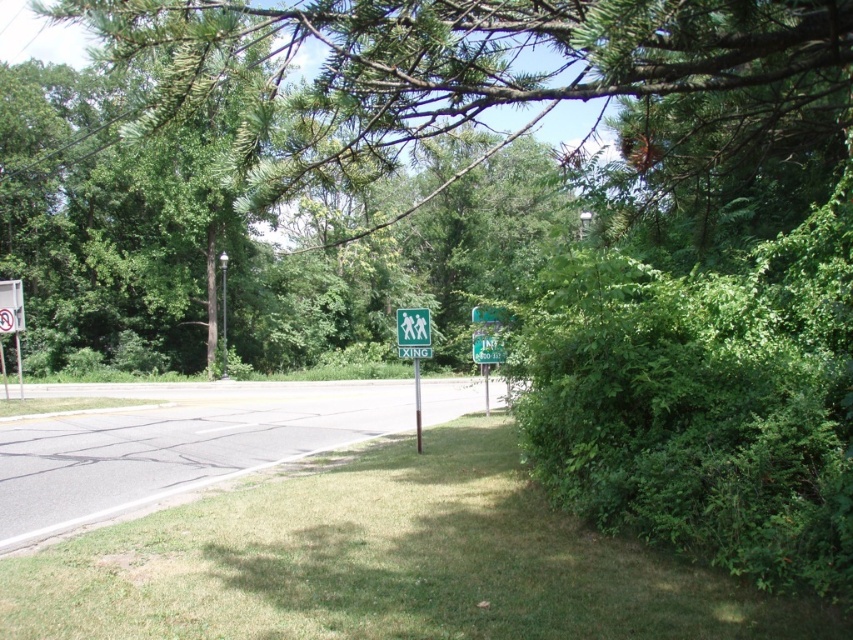
Question: Which object is the farthest from the green plastic pedestrian crossing sign at center?

Choices:
 (A) brown wooden pole at center
 (B) green matte pedestrian crossing sign at center
 (C) green leafy tree at center

Answer: (C)

Question: Is green grass at lower center to the left of green plastic sign at center from the viewer's perspective?

Choices:
 (A) yes
 (B) no

Answer: (A)

Question: Among these points, which one is nearest to the camera?

Choices:
 (A) (408, 42)
 (B) (416, 337)
 (C) (416, 433)
 (D) (401, 340)

Answer: (A)

Question: Is green grass at lower center to the left of green matte pedestrian crossing sign at center from the viewer's perspective?

Choices:
 (A) no
 (B) yes

Answer: (A)

Question: Which object is the closest to the green leafy tree at center?

Choices:
 (A) brown wooden pole at center
 (B) green plastic pedestrian crossing sign at center
 (C) green matte pedestrian crossing sign at center

Answer: (B)

Question: Does green leafy tree at center lie in front of green plastic pedestrian crossing sign at center?

Choices:
 (A) no
 (B) yes

Answer: (B)